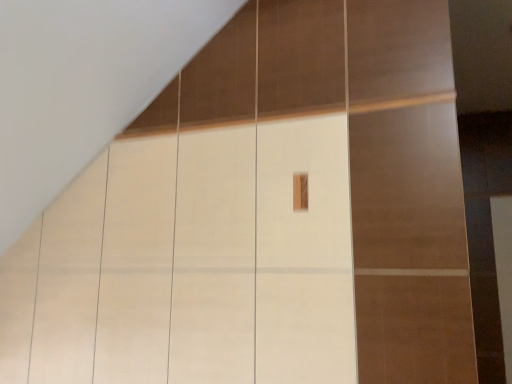
The height and width of the screenshot is (384, 512). What do you see at coordinates (300, 191) in the screenshot? I see `wooden frame at center` at bounding box center [300, 191].

The image size is (512, 384). I want to click on wooden frame at center, so [300, 191].

What are the coordinates of `wooden frame at center` in the screenshot? It's located at (300, 191).